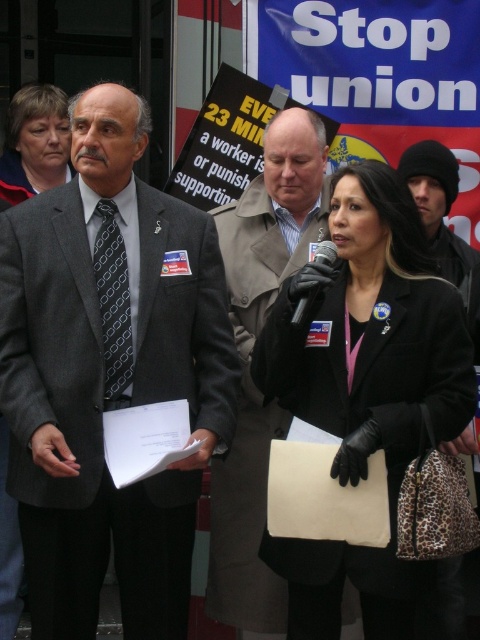
Based on the scene description, where is the gray textured suit at center located in terms of coordinates?

The gray textured suit at center is located at coordinates point (x=108, y=374).

You are a photographer at the protest scene. You need to focus your camera on the gray textured suit at center. What are the coordinates to aim your camera?

The gray textured suit at center is located at coordinates point (108,374).

You are standing at the camera position and want to determine which of the two points, point (46, 164) or point (443, 156), is closer to you. Based on the scene description, which point is nearer?

Point (46, 164) is further to the viewer than point (443, 156).